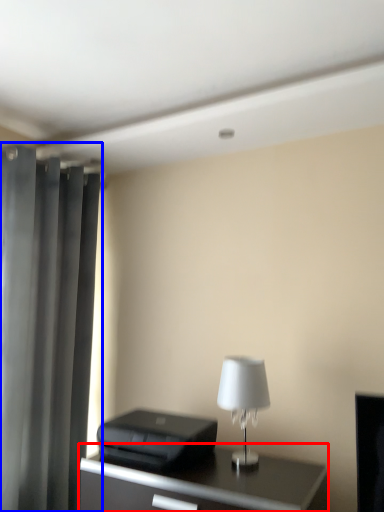
Question: Which point is closer to the camera, table (highlighted by a red box) or curtain (highlighted by a blue box)?

Choices:
 (A) table
 (B) curtain

Answer: (A)